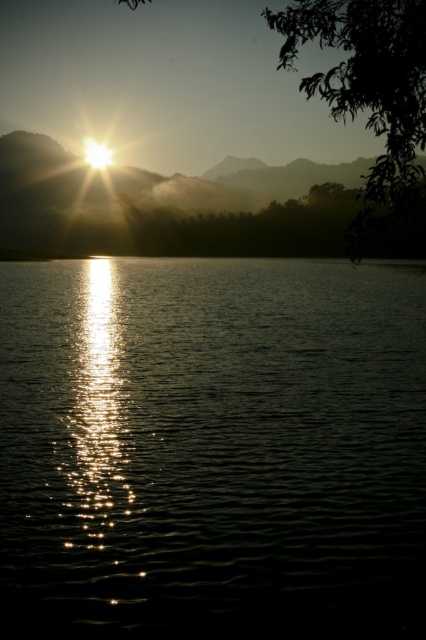
Which is more to the left, glistening liquid at center or green leafy tree at upper right?

glistening liquid at center

Does glistening liquid at center have a smaller size compared to green leafy tree at upper right?

Yes, glistening liquid at center is smaller than green leafy tree at upper right.

Between point (362, 376) and point (374, 168), which one is positioned in front?

Point (374, 168) is more forward.

Locate an element on the screen. This screenshot has width=426, height=640. glistening liquid at center is located at coordinates (212, 448).